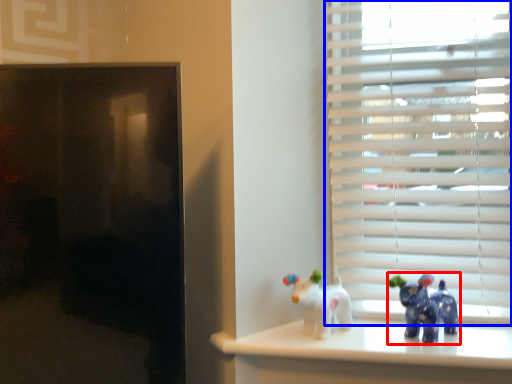
Question: Which point is further to the camera, toy (highlighted by a red box) or window blind (highlighted by a blue box)?

Choices:
 (A) toy
 (B) window blind

Answer: (B)